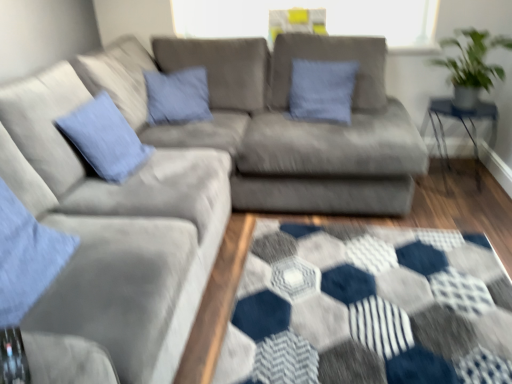
Question: Does green leafy plant at upper right have a smaller size compared to clear glass table at right?

Choices:
 (A) no
 (B) yes

Answer: (B)

Question: Would you say green leafy plant at upper right is outside clear glass table at right?

Choices:
 (A) no
 (B) yes

Answer: (B)

Question: Is green leafy plant at upper right oriented towards clear glass table at right?

Choices:
 (A) yes
 (B) no

Answer: (B)

Question: Is green leafy plant at upper right looking in the opposite direction of clear glass table at right?

Choices:
 (A) yes
 (B) no

Answer: (B)

Question: Considering the relative sizes of green leafy plant at upper right and clear glass table at right in the image provided, is green leafy plant at upper right thinner than clear glass table at right?

Choices:
 (A) no
 (B) yes

Answer: (B)

Question: Looking at their shapes, would you say blue cotton pillow at left, the 2th pillow viewed from the right, is wider or thinner than clear glass table at right?

Choices:
 (A) thin
 (B) wide

Answer: (A)

Question: From a real-world perspective, relative to clear glass table at right, is blue cotton pillow at left, the 1th pillow positioned from the left, vertically above or below?

Choices:
 (A) below
 (B) above

Answer: (B)

Question: From their relative heights in the image, would you say blue cotton pillow at left, which appears as the 2th pillow when viewed from the back, is taller or shorter than clear glass table at right?

Choices:
 (A) short
 (B) tall

Answer: (A)

Question: Looking at the image, does blue cotton pillow at left, the 1th pillow viewed from the front, seem bigger or smaller compared to clear glass table at right?

Choices:
 (A) small
 (B) big

Answer: (A)

Question: From the image's perspective, is blue cotton pillow at center, the second pillow when ordered from front to back, located above or below blue cotton pillow at left, the 1th pillow viewed from the front?

Choices:
 (A) above
 (B) below

Answer: (A)

Question: In terms of width, does blue cotton pillow at center, which is the first pillow in right-to-left order, look wider or thinner when compared to blue cotton pillow at left, the 1th pillow positioned from the left?

Choices:
 (A) wide
 (B) thin

Answer: (B)

Question: Which is correct: blue cotton pillow at center, positioned as the 1th pillow in back-to-front order, is inside blue cotton pillow at left, the 1th pillow viewed from the front, or outside of it?

Choices:
 (A) inside
 (B) outside

Answer: (B)

Question: Is blue cotton pillow at center, positioned as the 1th pillow in back-to-front order, to the left or to the right of blue cotton pillow at left, the 2th pillow viewed from the right, in the image?

Choices:
 (A) left
 (B) right

Answer: (B)

Question: Choose the correct answer: Is clear glass table at right inside green leafy plant at upper right or outside it?

Choices:
 (A) outside
 (B) inside

Answer: (A)

Question: From a real-world perspective, is clear glass table at right physically located above or below green leafy plant at upper right?

Choices:
 (A) above
 (B) below

Answer: (B)